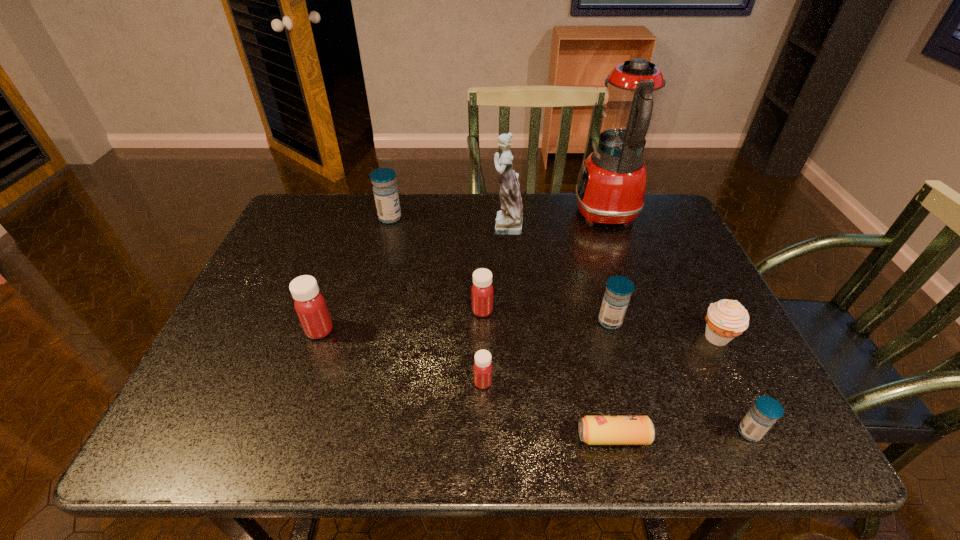
You are a GUI agent. You are given a task and a screenshot of the screen. Output one action in this format:
    pyautogui.click(x=<x>, y=<y>)
    Task: Click on the vacant space located on the front-facing side of the figurine
    The height and width of the screenshot is (540, 960).
    Given the screenshot: What is the action you would take?
    pos(384,225)

Locate an element on the screen. The height and width of the screenshot is (540, 960). free space located on the front of the farthest blue medicine is located at coordinates (374, 277).

You are a GUI agent. You are given a task and a screenshot of the screen. Output one action in this format:
    pyautogui.click(x=<x>, y=<y>)
    Task: Click on the vacant space located on the back of the leftmost object
    The height and width of the screenshot is (540, 960).
    Given the screenshot: What is the action you would take?
    pyautogui.click(x=339, y=274)

Identify the location of vacant area situated 0.140m on the right of the second blue medicine from left to right. Image resolution: width=960 pixels, height=540 pixels. (682, 321).

Where is `vacant space located on the left of the second biggest red medicine`? This screenshot has width=960, height=540. vacant space located on the left of the second biggest red medicine is located at coordinates (323, 311).

Where is `free space located 0.160m on the front of the muffin`? Image resolution: width=960 pixels, height=540 pixels. free space located 0.160m on the front of the muffin is located at coordinates (757, 417).

You are a GUI agent. You are given a task and a screenshot of the screen. Output one action in this format:
    pyautogui.click(x=<x>, y=<y>)
    Task: Click on the blank space located 0.150m on the left of the nearest red medicine
    The image size is (960, 540).
    Given the screenshot: What is the action you would take?
    pyautogui.click(x=401, y=382)

The height and width of the screenshot is (540, 960). I want to click on vacant region located on the left of the rightmost blue medicine, so click(675, 432).

This screenshot has width=960, height=540. I want to click on vacant space located 0.130m on the right of the beer can, so click(716, 437).

At what (x,y) coordinates should I click in order to perform the action: click on food processor that is positioned at the far edge. Please return your answer as a coordinate pair (x, y). Looking at the image, I should click on (611, 187).